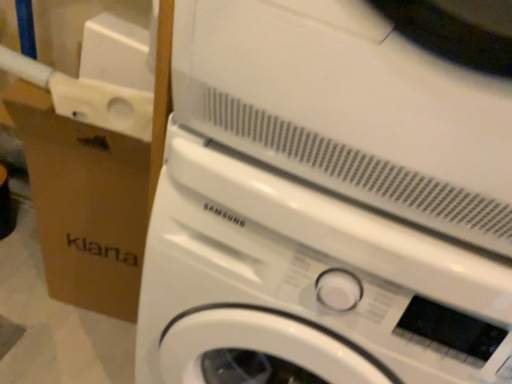
Question: Visually, is brown cardboard at left positioned to the left or to the right of white glossy washing machine at center?

Choices:
 (A) right
 (B) left

Answer: (B)

Question: Would you say brown cardboard at left is inside or outside white glossy washing machine at center?

Choices:
 (A) inside
 (B) outside

Answer: (B)

Question: Based on their sizes in the image, would you say brown cardboard at left is bigger or smaller than white glossy washing machine at center?

Choices:
 (A) big
 (B) small

Answer: (B)

Question: From their relative heights in the image, would you say white glossy washing machine at center is taller or shorter than brown cardboard at left?

Choices:
 (A) short
 (B) tall

Answer: (B)

Question: In terms of size, does white glossy washing machine at center appear bigger or smaller than brown cardboard at left?

Choices:
 (A) small
 (B) big

Answer: (B)

Question: From a real-world perspective, relative to brown cardboard at left, is white glossy washing machine at center vertically above or below?

Choices:
 (A) below
 (B) above

Answer: (B)

Question: Considering their positions, is white glossy washing machine at center located in front of or behind brown cardboard at left?

Choices:
 (A) front
 (B) behind

Answer: (A)